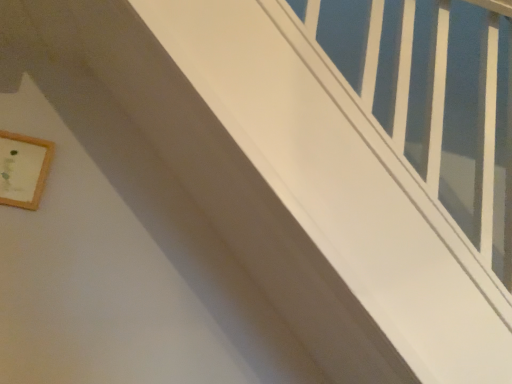
The height and width of the screenshot is (384, 512). What do you see at coordinates (23, 169) in the screenshot?
I see `wooden picture frame at upper left` at bounding box center [23, 169].

Locate an element on the screen. The image size is (512, 384). wooden picture frame at upper left is located at coordinates (23, 169).

Locate an element on the screen. wooden picture frame at upper left is located at coordinates (23, 169).